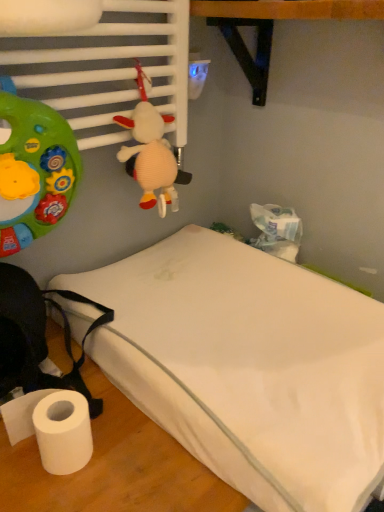
Question: From a real-world perspective, relative to white fabric bed at lower left, is plush beige at upper center vertically above or below?

Choices:
 (A) below
 (B) above

Answer: (B)

Question: Is plush beige at upper center to the left or to the right of white fabric bed at lower left in the image?

Choices:
 (A) right
 (B) left

Answer: (B)

Question: From the image's perspective, is plush beige at upper center located above or below white fabric bed at lower left?

Choices:
 (A) below
 (B) above

Answer: (B)

Question: Do you think white fabric bed at lower left is within plush beige at upper center, or outside of it?

Choices:
 (A) outside
 (B) inside

Answer: (A)

Question: Is white fabric bed at lower left to the left or to the right of plush beige at upper center in the image?

Choices:
 (A) right
 (B) left

Answer: (A)

Question: Looking at the image, does white fabric bed at lower left seem bigger or smaller compared to plush beige at upper center?

Choices:
 (A) small
 (B) big

Answer: (B)

Question: Does point (379, 388) appear closer or farther from the camera than point (168, 158)?

Choices:
 (A) farther
 (B) closer

Answer: (B)